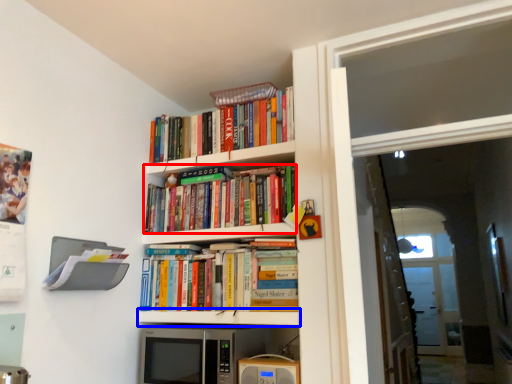
Question: Among these objects, which one is nearest to the camera, book (highlighted by a red box) or shelf (highlighted by a blue box)?

Choices:
 (A) book
 (B) shelf

Answer: (B)